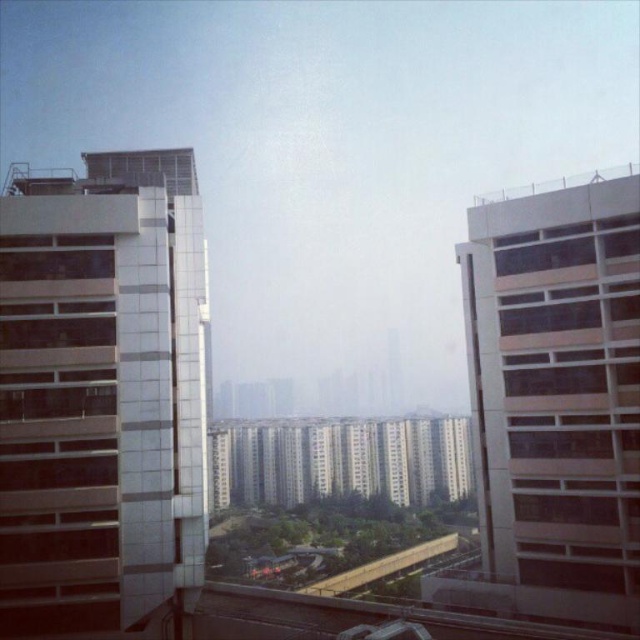
Question: Which of the following is the farthest from the observer?

Choices:
 (A) (232, 435)
 (B) (538, 392)

Answer: (A)

Question: Can you confirm if metallic glass building at left is wider than white glossy building at center?

Choices:
 (A) yes
 (B) no

Answer: (B)

Question: Among these objects, which one is nearest to the camera?

Choices:
 (A) metallic glass building at left
 (B) matte beige building at right
 (C) white glossy building at center

Answer: (B)

Question: Which object is positioned farthest from the metallic glass building at left?

Choices:
 (A) matte beige building at right
 (B) white glossy building at center

Answer: (B)

Question: Is metallic glass building at left positioned before white glossy building at center?

Choices:
 (A) no
 (B) yes

Answer: (B)

Question: Is the position of metallic glass building at left more distant than that of matte beige building at right?

Choices:
 (A) no
 (B) yes

Answer: (B)